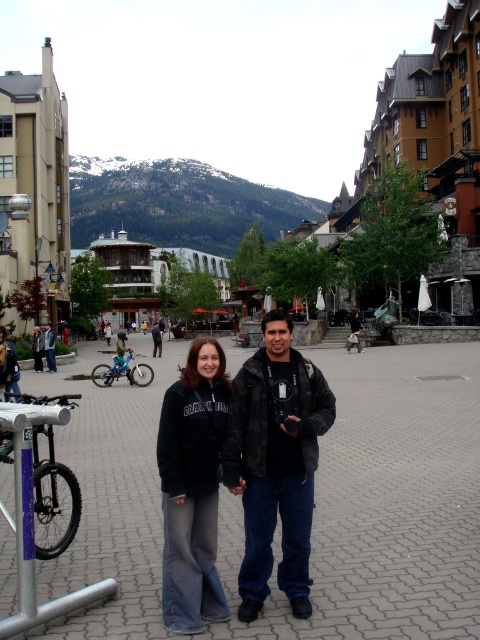
You are standing in the plaza and want to take a photo that includes both point (245, 502) and point (31, 397). Which point should you focus on to ensure both are in sharp focus?

You should focus on point (245, 502) because it is closer to the camera, ensuring both points are within the depth of field.

You are a customer in a store looking at two jackets displayed on a rack. The jackets are the black matte jacket at center and the black fleece jacket at center. Which jacket is hanging lower on the rack?

The black matte jacket at center is hanging lower because it is positioned under the black fleece jacket at center.

You are a delivery person who needs to carry a large package from the blue metallic bicycle at lower left to the black leather jacket at center. The package is 1.2 meters wide. Can you carry it through the space between them without bending or tilting it?

The blue metallic bicycle at lower left might be wider than black leather jacket at center. If the bicycle is wider than the jacket, the space between them may be insufficient for a 1.2 meter wide package. However, without exact measurements, it is uncertain. Please check the actual width before attempting to carry the package.